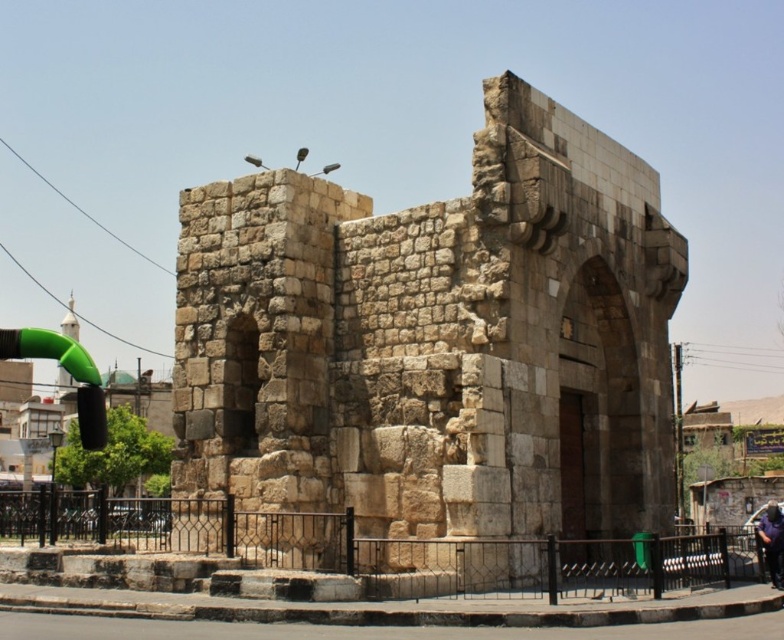
You are standing in front of the historical stone structure. You notice the stone archway at center and the dark blue shirt at lower right. Which object is nearer to you?

The stone archway at center is closer to the viewer than the dark blue shirt at lower right, so the stone archway at center is nearer to you.

You are a photographer planning to take a photo of the stone archway at center and the dark blue shirt at lower right. You want to ensure both subjects are fully visible in the frame. Which subject requires a wider angle lens to capture its full width?

The stone archway at center requires a wider angle lens because its width surpasses that of the dark blue shirt at lower right, necessitating a lens capable of capturing broader scenes.